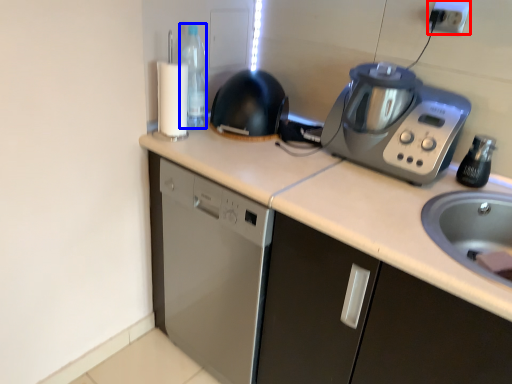
Question: Which point is closer to the camera, electric outlet (highlighted by a red box) or bottle (highlighted by a blue box)?

Choices:
 (A) electric outlet
 (B) bottle

Answer: (A)